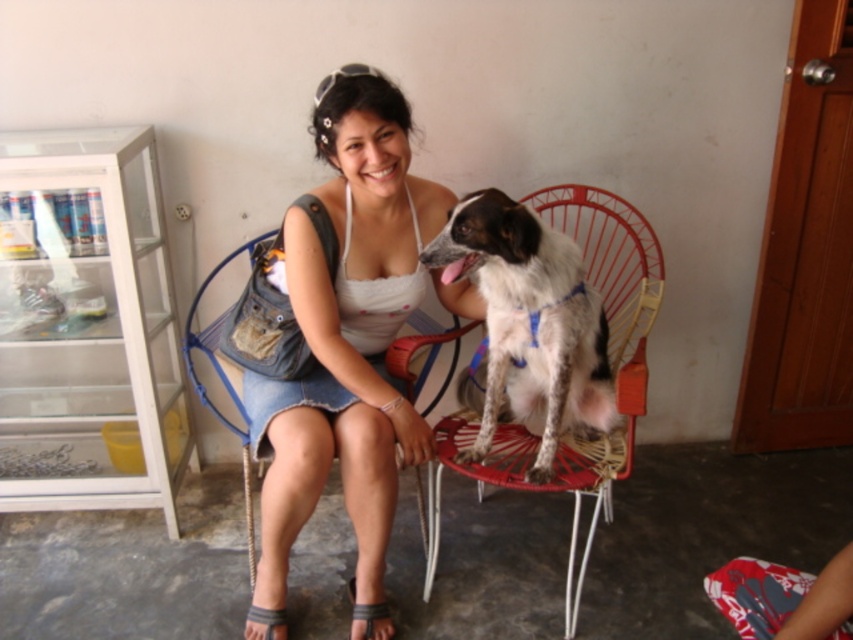
You are a photographer standing at the camera position. You want to adjust your position so that the white denim skirt at center is exactly 5 feet away from you. Should you move closer or farther away?

The white denim skirt at center is currently 5.25 feet away from the camera. To make it 5 feet away, you should move closer by 0.25 feet.

You are a photographer trying to capture a closeup of the white denim skirt at center. Based on its position coordinates, where should you aim your camera?

The white denim skirt at center is located at point (x=346, y=330), so aim your camera at those coordinates to capture the closeup.